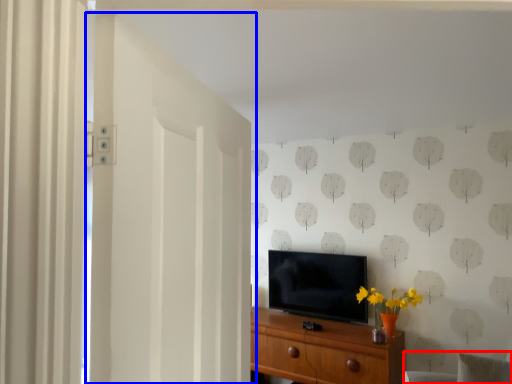
Question: Which point is closer to the camera, swivel chair (highlighted by a red box) or door (highlighted by a blue box)?

Choices:
 (A) swivel chair
 (B) door

Answer: (B)